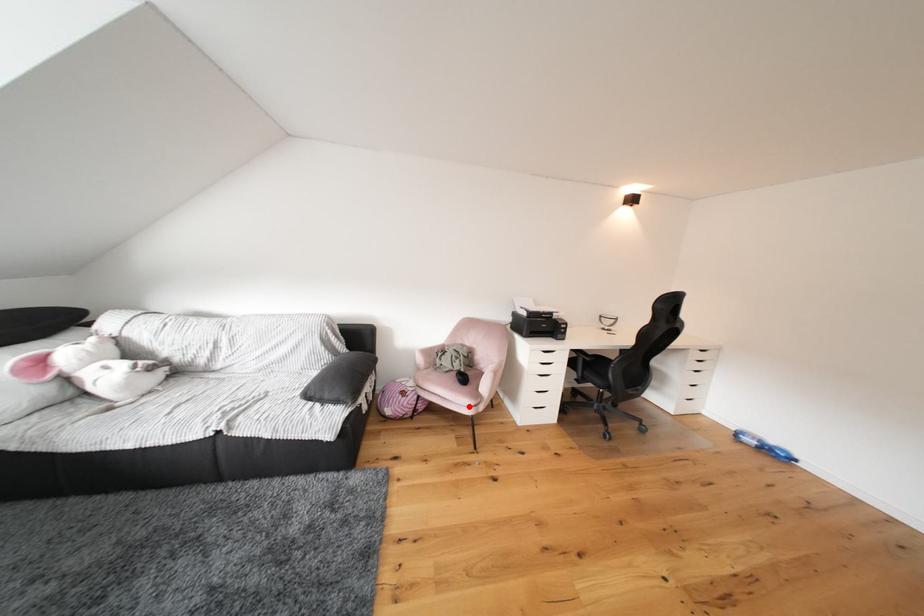
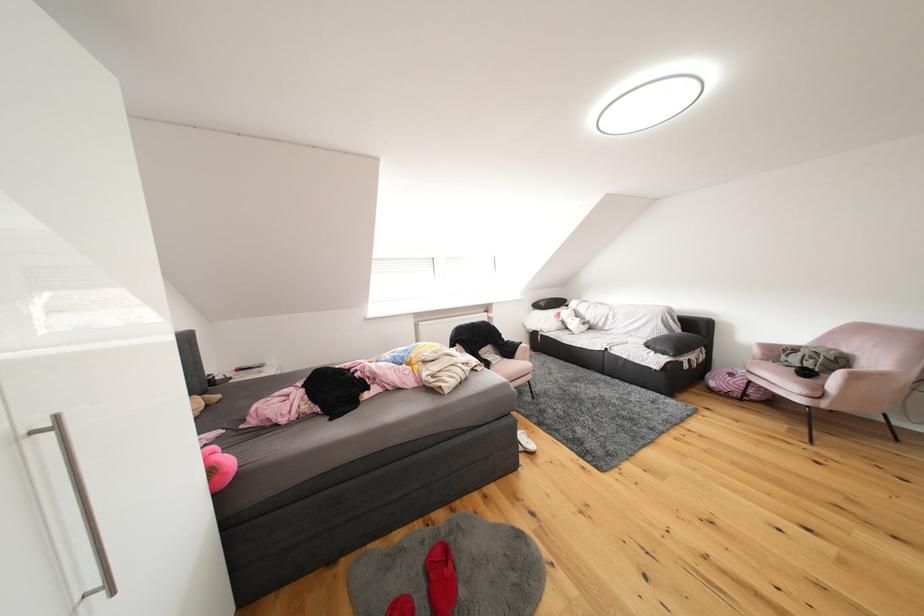
Locate, in the second image, the point that corresponds to the highlighted location in the first image.

(797, 392)